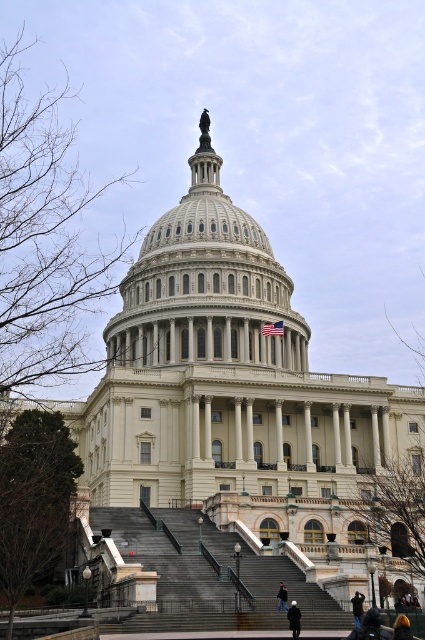
You are a photographer standing at the base of the U.S. Capitol Building. You want to take a photo that includes both the orange hair at lower right and the dark blue jeans at lower center. Given that your camera has a maximum zoom range of 10 feet, will you be able to capture both subjects in a single frame without moving closer?

The distance between the orange hair at lower right and the dark blue jeans at lower center is 16.40 feet. Since your camera can only zoom up to 10 feet, you will not be able to capture both subjects in a single frame without moving closer.

You are standing at the base of the United States Capitol Building and notice a point marked at coordinates (357, 605). According to the image, what object is this point located on?

The point at coordinates (357, 605) is located on the black leather jacket at lower right.